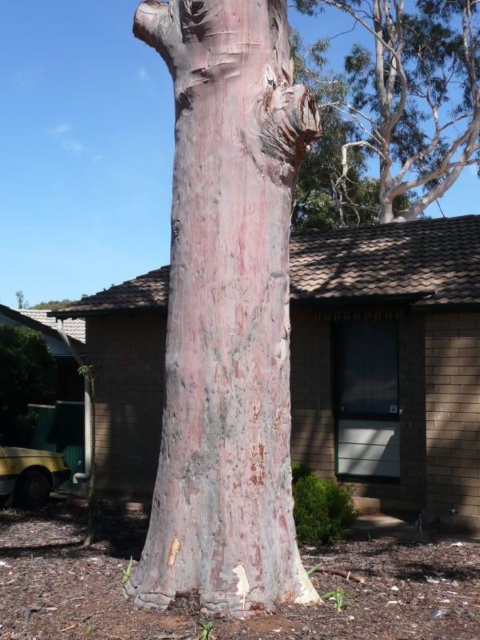
Question: Which is nearer to the green matte bush at lower left?

Choices:
 (A) speckled bark tree trunk at center
 (B) smooth bark tree trunk at upper center

Answer: (A)

Question: Which point is farther to the camera?

Choices:
 (A) (462, 122)
 (B) (264, 522)

Answer: (A)

Question: Does smooth bark tree trunk at upper center have a lesser width compared to green matte bush at lower left?

Choices:
 (A) yes
 (B) no

Answer: (B)

Question: Is smooth bark tree trunk at upper center closer to camera compared to green matte bush at lower left?

Choices:
 (A) yes
 (B) no

Answer: (B)

Question: Which of the following is the farthest from the observer?

Choices:
 (A) (244, 208)
 (B) (417, 148)
 (C) (43, 376)

Answer: (B)

Question: Where is speckled bark tree trunk at center located in relation to smooth bark tree trunk at upper center in the image?

Choices:
 (A) left
 (B) right

Answer: (A)